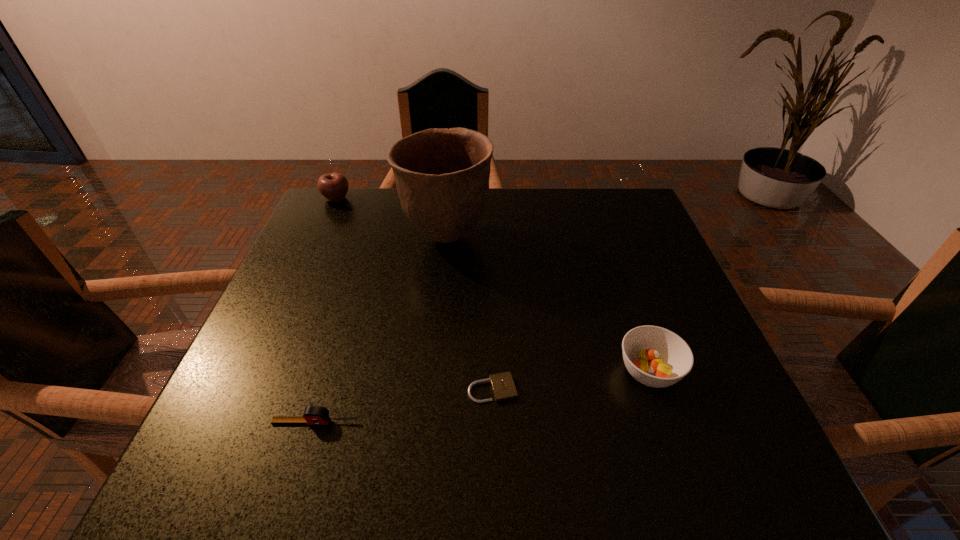
At what (x,y) coordinates should I click in order to perform the action: click on vacant space at the far edge. Please return your answer as a coordinate pair (x, y). Looking at the image, I should click on (399, 233).

I want to click on blank space at the near edge, so pyautogui.click(x=406, y=481).

Locate an element on the screen. This screenshot has width=960, height=540. free space at the left edge of the desktop is located at coordinates (284, 285).

Identify the location of free space at the right edge of the desktop. (602, 256).

You are a GUI agent. You are given a task and a screenshot of the screen. Output one action in this format:
    pyautogui.click(x=<x>, y=<y>)
    Task: Click on the blank space at the far left corner of the desktop
    The image size is (960, 540).
    Given the screenshot: What is the action you would take?
    pyautogui.click(x=346, y=215)

Image resolution: width=960 pixels, height=540 pixels. In the image, there is a desktop. Identify the location of free region at the far right corner. (620, 194).

The width and height of the screenshot is (960, 540). I want to click on vacant space at the near right corner of the desktop, so click(x=729, y=457).

Image resolution: width=960 pixels, height=540 pixels. In order to click on unoccupied area between the padlock and the nearest object in this screenshot , I will do `click(404, 406)`.

You are a GUI agent. You are given a task and a screenshot of the screen. Output one action in this format:
    pyautogui.click(x=<x>, y=<y>)
    Task: Click on the free space between the third tallest object and the apple
    
    Given the screenshot: What is the action you would take?
    pyautogui.click(x=492, y=285)

You are a GUI agent. You are given a task and a screenshot of the screen. Output one action in this format:
    pyautogui.click(x=<x>, y=<y>)
    Task: Click on the vacant region between the fourth tallest object and the padlock
    
    Given the screenshot: What is the action you would take?
    pyautogui.click(x=404, y=406)